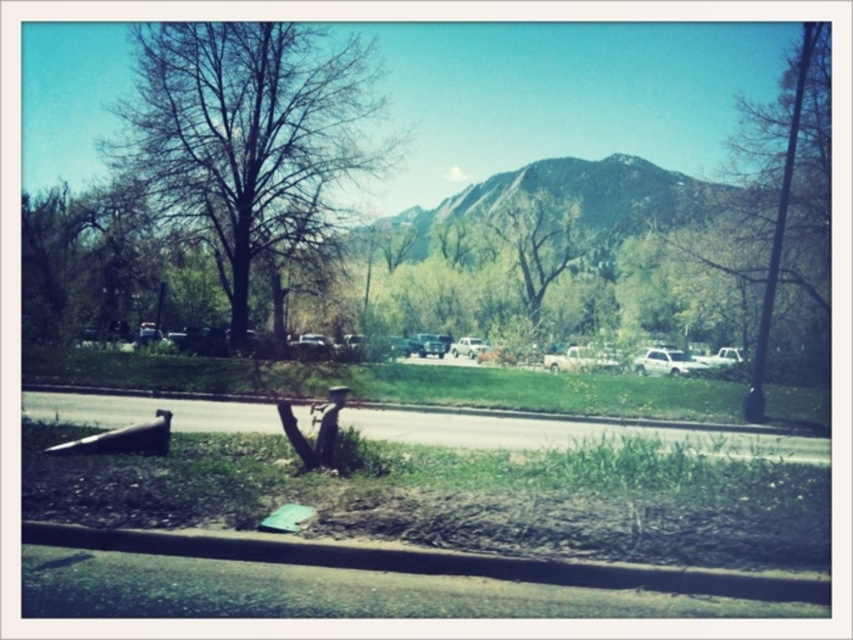
Does white matte suv at center-right appear on the left side of metallic silver car at center?

In fact, white matte suv at center-right is to the right of metallic silver car at center.

Which is behind, point (685, 355) or point (466, 340)?

The point (466, 340) is behind.

Between point (657, 372) and point (480, 340), which one is positioned behind?

Positioned behind is point (480, 340).

Identify the location of white matte suv at center-right. The width and height of the screenshot is (853, 640). (665, 362).

Find the location of a particular element. grassy patch at lower left is located at coordinates (444, 484).

Is bare wood tree at upper left to the right of green textured mountain at center from the viewer's perspective?

Incorrect, bare wood tree at upper left is not on the right side of green textured mountain at center.

Is point (305, 42) positioned in front of point (538, 180)?

That is True.

Between point (334, 150) and point (468, 200), which one is positioned behind?

The point (468, 200) is behind.

Identify the location of bare wood tree at upper left. The width and height of the screenshot is (853, 640). (247, 140).